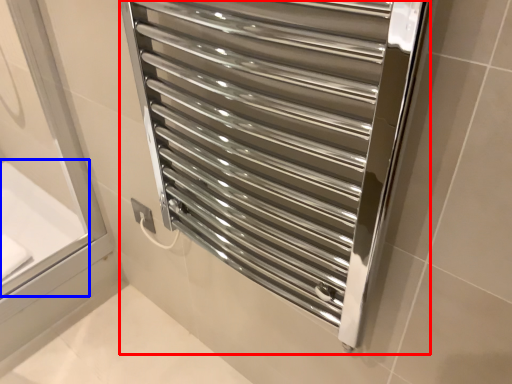
Question: Which object appears closest to the camera in this image, towel rack (highlighted by a red box) or bath (highlighted by a blue box)?

Choices:
 (A) towel rack
 (B) bath

Answer: (A)